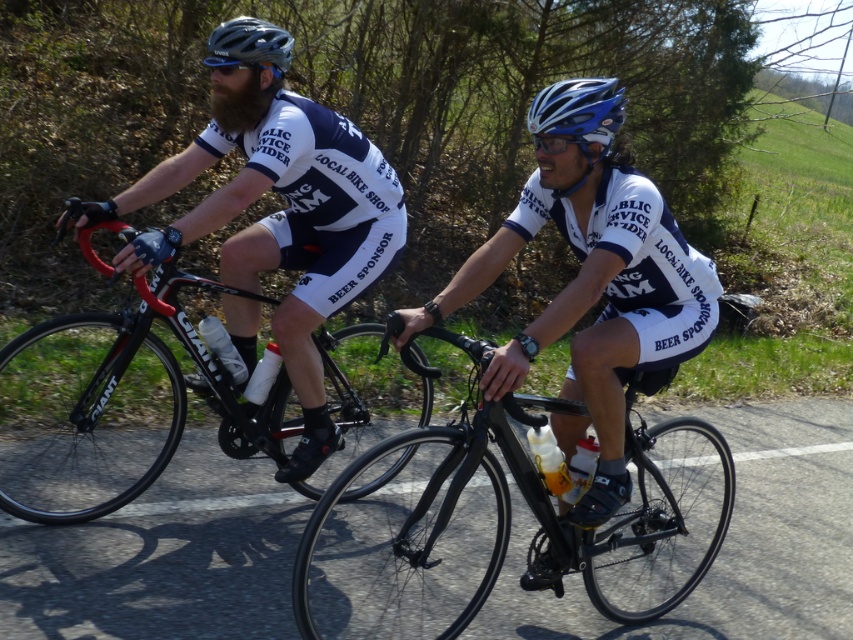
Which is more to the left, shiny black frame at left or matte blue helmet at upper center?

Positioned to the left is shiny black frame at left.

Is point (91, 454) less distant than point (276, 76)?

No, (91, 454) is further to viewer.

Who is more forward, [231,433] or [244,58]?

Point [244,58] is more forward.

In order to click on shiny black frame at left in this screenshot , I will do `click(115, 406)`.

Between shiny black frame at left and blue glossy helmet at center, which one appears on the left side from the viewer's perspective?

shiny black frame at left

Can you confirm if shiny black frame at left is thinner than blue glossy helmet at center?

No.

This screenshot has height=640, width=853. In order to click on shiny black frame at left in this screenshot , I will do `click(115, 406)`.

Locate an element on the screen. shiny black frame at left is located at coordinates (115, 406).

Which is below, matte blue helmet at upper center or shiny blue helmet at center?

shiny blue helmet at center is below.

The image size is (853, 640). Describe the element at coordinates (247, 68) in the screenshot. I see `matte blue helmet at upper center` at that location.

Between point (259, 38) and point (605, 93), which one is positioned in front?

Point (605, 93) is in front.

Where is `matte blue helmet at upper center`? This screenshot has height=640, width=853. matte blue helmet at upper center is located at coordinates [x=247, y=68].